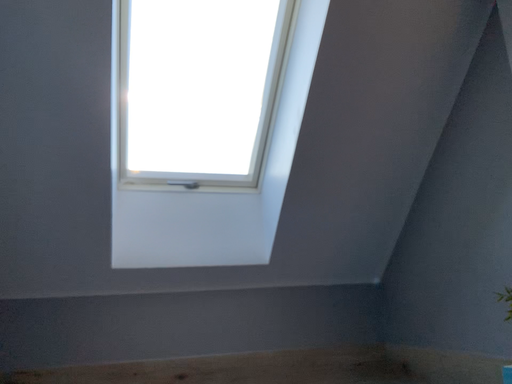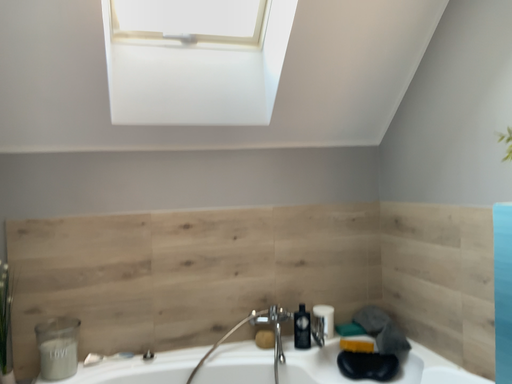
Question: Which way did the camera rotate in the video?

Choices:
 (A) rotated downward
 (B) rotated upward

Answer: (A)